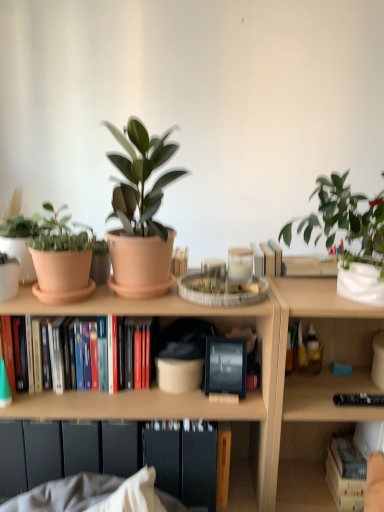
This screenshot has width=384, height=512. I want to click on vacant area located to the right-hand side of terracotta clay pot at left, marked as the second flowerpot in a right-to-left arrangement, so pos(126,300).